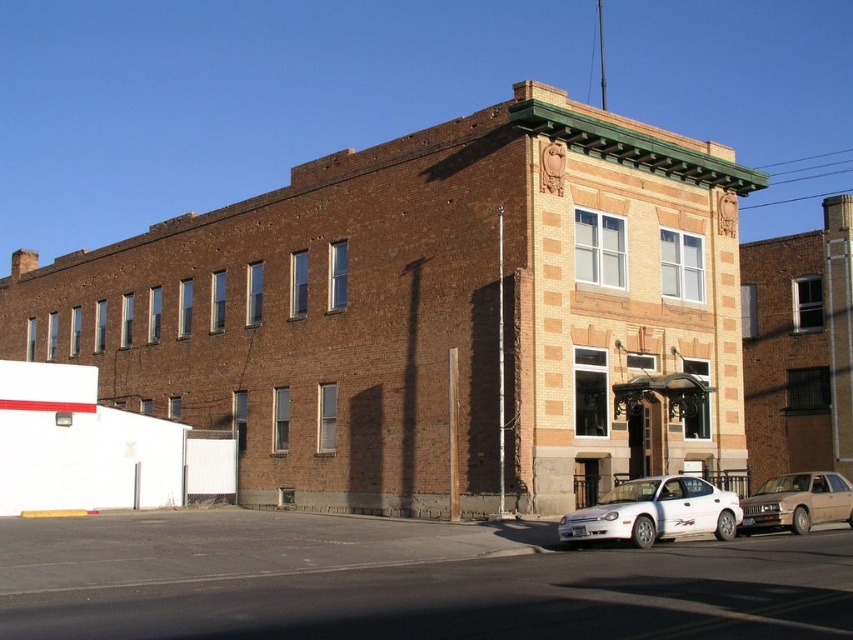
You are a delivery person approaching the entrance of the two story brick building. You see a white matte sedan at lower right and a gold metallic sedan at lower right. Which car is parked closer to the entrance?

The white matte sedan at lower right is above the gold metallic sedan at lower right, so the gold metallic sedan at lower right is closer to the entrance.

You are standing in front of the two story brick building. You see a point marked at coordinates (654, 513). What object is located at that point?

The point at coordinates (654, 513) marks the white matte sedan at lower right.

You are a delivery person needing to park your vehicle. You see a white matte sedan at lower right and a gold metallic sedan at lower right. Which vehicle is blocking the parking spot closer to the entrance?

The white matte sedan at lower right is in front of the gold metallic sedan at lower right, so it is blocking the parking spot closer to the entrance.